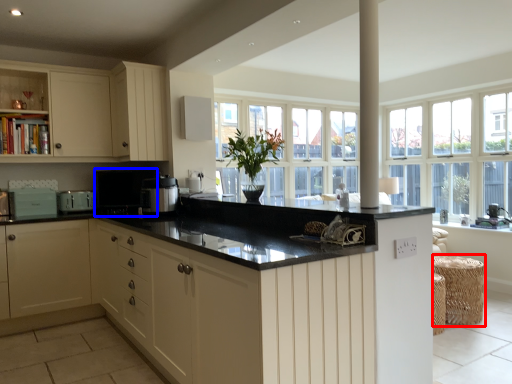
Question: Among these objects, which one is nearest to the camera, bar stool (highlighted by a red box) or appliance (highlighted by a blue box)?

Choices:
 (A) bar stool
 (B) appliance

Answer: (A)